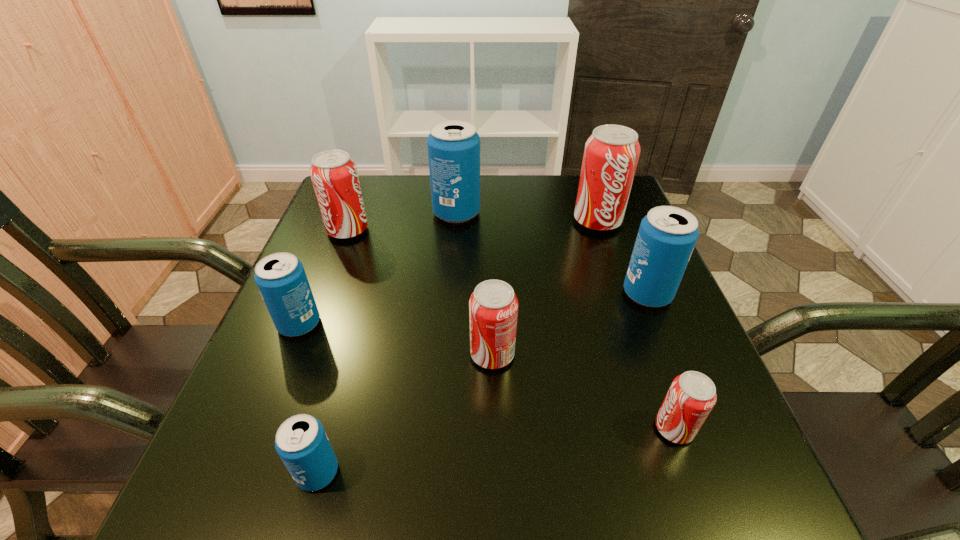
I want to click on free space that satisfies the following two spatial constraints: 1. on the logo side of the biggest red soda can; 2. on the logo side of the leftmost red soda can, so click(x=600, y=230).

Locate an element on the screen. The image size is (960, 540). vacant space that satisfies the following two spatial constraints: 1. on the logo side of the third smallest red soda can; 2. on the left side of the nearest soda can is located at coordinates pos(256,472).

Where is `vacant area in the image that satisfies the following two spatial constraints: 1. on the logo side of the leftmost red soda can; 2. on the back side of the smallest blue soda can`? Image resolution: width=960 pixels, height=540 pixels. vacant area in the image that satisfies the following two spatial constraints: 1. on the logo side of the leftmost red soda can; 2. on the back side of the smallest blue soda can is located at coordinates (256, 472).

This screenshot has width=960, height=540. What are the coordinates of `vacant space that satisfies the following two spatial constraints: 1. on the logo side of the rightmost blue soda can; 2. on the right side of the third smallest red soda can` in the screenshot? It's located at (324, 294).